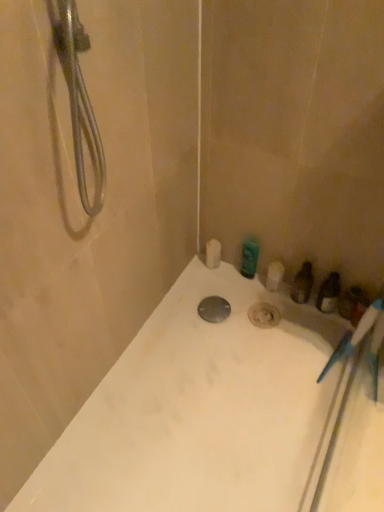
Image resolution: width=384 pixels, height=512 pixels. Describe the element at coordinates (198, 410) in the screenshot. I see `white glossy bathtub at center` at that location.

The height and width of the screenshot is (512, 384). Describe the element at coordinates (249, 257) in the screenshot. I see `green glossy bottle at upper right, which is counted as the 1th toiletry, starting from the left` at that location.

Find the location of a particular element. metallic silver drain at center is located at coordinates (214, 309).

Does point (218, 265) come in front of point (226, 314)?

No, it is behind (226, 314).

Could metallic silver drain at center be considered to be inside white matte toilet paper at upper center?

No, metallic silver drain at center is not surrounded by white matte toilet paper at upper center.

Considering the sizes of objects white matte toilet paper at upper center and metallic silver drain at center in the image provided, who is thinner, white matte toilet paper at upper center or metallic silver drain at center?

Thinner between the two is white matte toilet paper at upper center.

The image size is (384, 512). In order to click on drain in front of the white matte toilet paper at upper center in this screenshot , I will do `click(214, 309)`.

Can you tell me how much translucent plastic bottle at right, which ranks as the 1th toiletry in right-to-left order, and white glossy bathtub at center differ in facing direction?

translucent plastic bottle at right, which ranks as the 1th toiletry in right-to-left order, and white glossy bathtub at center are facing 88.6 degrees away from each other.

Who is more distant, translucent plastic bottle at right, the second toiletry when ordered from top to bottom, or white glossy bathtub at center?

translucent plastic bottle at right, the second toiletry when ordered from top to bottom, is further away from the camera.

In the scene shown: Does translucent plastic bottle at right, positioned as the 1th toiletry in bottom-to-top order, have a lesser height compared to white glossy bathtub at center?

Incorrect, the height of translucent plastic bottle at right, positioned as the 1th toiletry in bottom-to-top order, does not fall short of that of white glossy bathtub at center.

Is translucent plastic bottle at right, the second toiletry when ordered from top to bottom, wider than white glossy bathtub at center?

In fact, translucent plastic bottle at right, the second toiletry when ordered from top to bottom, might be narrower than white glossy bathtub at center.

Could you measure the distance between translucent plastic bottle at right, which is the second toiletry from left to right, and white matte toilet paper at upper center?

translucent plastic bottle at right, which is the second toiletry from left to right, is 20.14 inches away from white matte toilet paper at upper center.

Can you tell me how much translucent plastic bottle at right, which is the second toiletry from left to right, and white matte toilet paper at upper center differ in facing direction?

translucent plastic bottle at right, which is the second toiletry from left to right, and white matte toilet paper at upper center are facing 1.05 degrees away from each other.

Is translucent plastic bottle at right, which is the second toiletry from left to right, to the left or to the right of white matte toilet paper at upper center in the image?

Based on their positions, translucent plastic bottle at right, which is the second toiletry from left to right, is located to the right of white matte toilet paper at upper center.

Looking at this image, is translucent plastic bottle at right, positioned as the 1th toiletry in bottom-to-top order, situated inside white matte toilet paper at upper center or outside?

translucent plastic bottle at right, positioned as the 1th toiletry in bottom-to-top order, is not enclosed by white matte toilet paper at upper center.

Is metallic silver drain at center located within translucent plastic bottle at right, positioned as the 1th toiletry in bottom-to-top order?

That's incorrect, metallic silver drain at center is not inside translucent plastic bottle at right, positioned as the 1th toiletry in bottom-to-top order.

How much distance is there between translucent plastic bottle at right, the second toiletry when ordered from top to bottom, and metallic silver drain at center?

A distance of 16.94 inches exists between translucent plastic bottle at right, the second toiletry when ordered from top to bottom, and metallic silver drain at center.

Is translucent plastic bottle at right, which is the second toiletry from left to right, at the left side of metallic silver drain at center?

In fact, translucent plastic bottle at right, which is the second toiletry from left to right, is to the right of metallic silver drain at center.

From the image's perspective, starting from the metallic silver drain at center, which toiletry is the 1st one above? Please provide its 2D coordinates.

[(350, 302)]

Do you think green glossy bottle at upper right, the second toiletry viewed from the right, is within translucent plastic bottle at right, the second toiletry when ordered from top to bottom, or outside of it?

green glossy bottle at upper right, the second toiletry viewed from the right, lies outside translucent plastic bottle at right, the second toiletry when ordered from top to bottom.

Does green glossy bottle at upper right, placed as the 1th toiletry when sorted from top to bottom, touch translucent plastic bottle at right, the second toiletry when ordered from top to bottom?

No, green glossy bottle at upper right, placed as the 1th toiletry when sorted from top to bottom, is not with translucent plastic bottle at right, the second toiletry when ordered from top to bottom.

Is the depth of green glossy bottle at upper right, which is counted as the 1th toiletry, starting from the left, less than that of translucent plastic bottle at right, the second toiletry when ordered from top to bottom?

No, it is not.

From a real-world perspective, who is located lower, green glossy bottle at upper right, placed as the 1th toiletry when sorted from top to bottom, or translucent plastic bottle at right, the second toiletry when ordered from top to bottom?

translucent plastic bottle at right, the second toiletry when ordered from top to bottom.

From a real-world perspective, who is located lower, white matte toilet paper at upper center or translucent plastic bottle at right, the second toiletry when ordered from top to bottom?

translucent plastic bottle at right, the second toiletry when ordered from top to bottom, is physically lower.

Looking at this image, from their relative heights in the image, would you say white matte toilet paper at upper center is taller or shorter than translucent plastic bottle at right, the second toiletry when ordered from top to bottom?

Clearly, white matte toilet paper at upper center is shorter compared to translucent plastic bottle at right, the second toiletry when ordered from top to bottom.

From the image's perspective, is white matte toilet paper at upper center above or below translucent plastic bottle at right, the second toiletry when ordered from top to bottom?

white matte toilet paper at upper center is situated higher than translucent plastic bottle at right, the second toiletry when ordered from top to bottom, in the image.

Can you confirm if white matte toilet paper at upper center is thinner than translucent plastic bottle at right, which ranks as the 1th toiletry in right-to-left order?

Correct, the width of white matte toilet paper at upper center is less than that of translucent plastic bottle at right, which ranks as the 1th toiletry in right-to-left order.

Visually, is white glossy bathtub at center positioned to the left or to the right of translucent plastic bottle at right, which is the second toiletry from left to right?

In the image, white glossy bathtub at center appears on the left side of translucent plastic bottle at right, which is the second toiletry from left to right.

Does point (274, 377) appear closer or farther from the camera than point (349, 307)?

Point (274, 377) appears to be closer to the viewer than point (349, 307).

Between white glossy bathtub at center and translucent plastic bottle at right, positioned as the 1th toiletry in bottom-to-top order, which one has larger size?

Bigger between the two is white glossy bathtub at center.

Considering the positions of objects white glossy bathtub at center and translucent plastic bottle at right, which ranks as the 1th toiletry in right-to-left order, in the image provided, who is in front, white glossy bathtub at center or translucent plastic bottle at right, which ranks as the 1th toiletry in right-to-left order,?

Positioned in front is white glossy bathtub at center.

In the image, there is a white matte toilet paper at upper center. Where is `drain below it (from the image's perspective)`? drain below it (from the image's perspective) is located at coordinates (214, 309).

At what (x,y) coordinates should I click in order to perform the action: click on the 1st toiletry positioned above the white glossy bathtub at center (from a real-world perspective). Please return your answer as a coordinate pair (x, y). Looking at the image, I should click on (350, 302).

When comparing their distances from metallic silver drain at center, does green glossy bottle at upper right, which is counted as the 1th toiletry, starting from the left, or white glossy bathtub at center seem further?

Among the two, white glossy bathtub at center is located further to metallic silver drain at center.

Considering their positions, is translucent plastic bottle at right, which ranks as the 1th toiletry in right-to-left order, positioned closer to green glossy bottle at upper right, placed as the 1th toiletry when sorted from top to bottom, than metallic silver drain at center?

metallic silver drain at center is closer to green glossy bottle at upper right, placed as the 1th toiletry when sorted from top to bottom.

From the image, which object appears to be farther from translucent plastic bottle at right, positioned as the 1th toiletry in bottom-to-top order, metallic silver drain at center or green glossy bottle at upper right, the second toiletry viewed from the right?

The object further to translucent plastic bottle at right, positioned as the 1th toiletry in bottom-to-top order, is metallic silver drain at center.

Looking at the image, which one is located further to white matte toilet paper at upper center, white glossy bathtub at center or translucent plastic bottle at right, positioned as the 1th toiletry in bottom-to-top order?

Based on the image, white glossy bathtub at center appears to be further to white matte toilet paper at upper center.

From the picture: Considering their positions, is white matte toilet paper at upper center positioned closer to translucent plastic bottle at right, which is the second toiletry from left to right, than white glossy bathtub at center?

white matte toilet paper at upper center lies closer to translucent plastic bottle at right, which is the second toiletry from left to right, than the other object.

Based on the photo, considering their positions, is white glossy bathtub at center positioned closer to translucent plastic bottle at right, which ranks as the 1th toiletry in right-to-left order, than white matte toilet paper at upper center?

white matte toilet paper at upper center is positioned closer to the anchor translucent plastic bottle at right, which ranks as the 1th toiletry in right-to-left order.

Looking at the image, which one is located further to translucent plastic bottle at right, positioned as the 1th toiletry in bottom-to-top order, white glossy bathtub at center or metallic silver drain at center?

white glossy bathtub at center is further to translucent plastic bottle at right, positioned as the 1th toiletry in bottom-to-top order.

Looking at the image, which one is located closer to green glossy bottle at upper right, the second toiletry from the bottom, translucent plastic bottle at right, the second toiletry when ordered from top to bottom, or white matte toilet paper at upper center?

white matte toilet paper at upper center is closer to green glossy bottle at upper right, the second toiletry from the bottom.

I want to click on toiletry between white glossy bathtub at center and green glossy bottle at upper right, the second toiletry from the bottom, along the z-axis, so click(x=350, y=302).

Locate an element on the screen. The height and width of the screenshot is (512, 384). toiletry situated between metallic silver drain at center and translucent plastic bottle at right, positioned as the 1th toiletry in bottom-to-top order, from left to right is located at coordinates (249, 257).

The height and width of the screenshot is (512, 384). What are the coordinates of `toiletry located between white matte toilet paper at upper center and translucent plastic bottle at right, which is the second toiletry from left to right, in the left-right direction` in the screenshot? It's located at (249, 257).

Identify the location of drain located between white glossy bathtub at center and green glossy bottle at upper right, placed as the 1th toiletry when sorted from top to bottom, in the depth direction. click(214, 309).